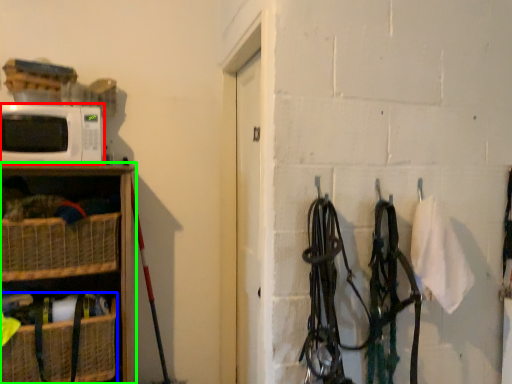
Question: Which object is the closest to the microwave oven (highlighted by a red box)? Choose among these: basket (highlighted by a blue box) or shelf (highlighted by a green box).

Choices:
 (A) basket
 (B) shelf

Answer: (B)